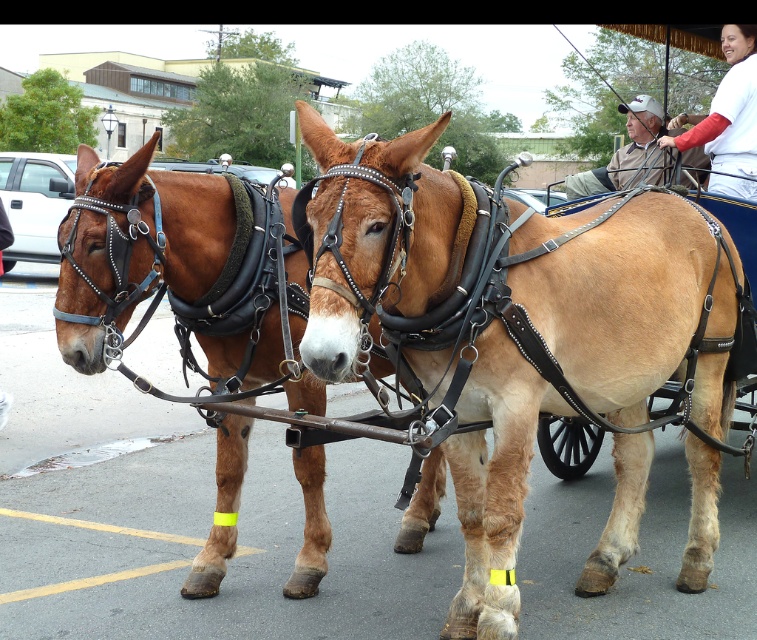
Question: In this image, where is light brown leather harness at center located relative to brown leather harness at left?

Choices:
 (A) right
 (B) left

Answer: (A)

Question: Can you confirm if light brown leather harness at center is positioned to the right of white cotton shirt at upper right?

Choices:
 (A) yes
 (B) no

Answer: (B)

Question: Which of the following is the farthest from the observer?

Choices:
 (A) light brown leather harness at center
 (B) white cotton shirt at upper right

Answer: (B)

Question: Can you confirm if brown leather harness at left is bigger than white cotton shirt at upper right?

Choices:
 (A) no
 (B) yes

Answer: (B)

Question: Which object appears closest to the camera in this image?

Choices:
 (A) light brown leather harness at center
 (B) white cotton shirt at upper right

Answer: (A)

Question: Which object is positioned closest to the white cotton shirt at upper right?

Choices:
 (A) brown leather harness at left
 (B) light brown leather harness at center

Answer: (B)